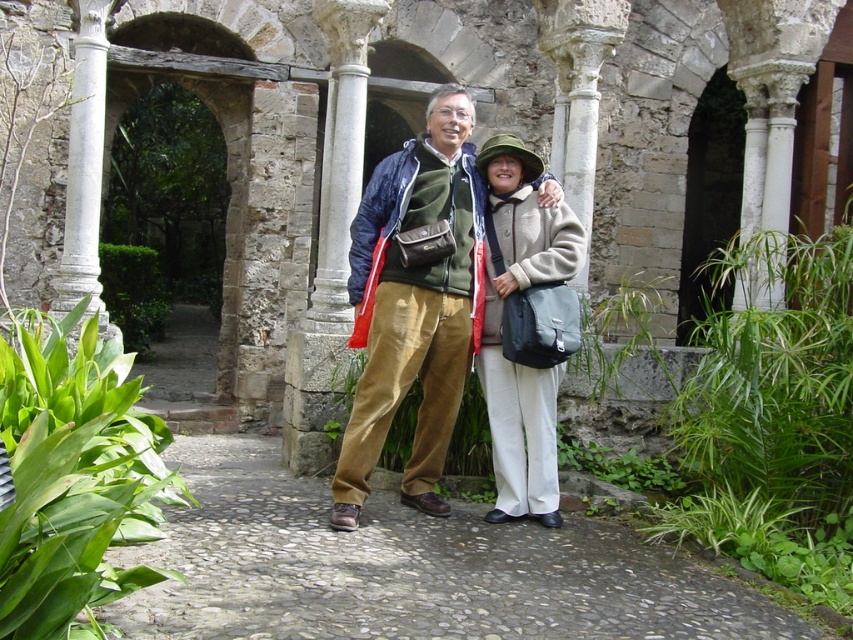
Describe the element at coordinates (410, 570) in the screenshot. The image size is (853, 640). I see `gray cobblestone path at center` at that location.

Is point (451, 621) closer to camera compared to point (456, 285)?

Yes.

The width and height of the screenshot is (853, 640). Identify the location of gray cobblestone path at center. (410, 570).

From the picture: Which of these two, matte green jacket at center or light beige wool coat at center, stands taller?

Standing taller between the two is matte green jacket at center.

Who is higher up, matte green jacket at center or light beige wool coat at center?

matte green jacket at center

Between point (372, 312) and point (541, 508), which one is positioned behind?

The point (372, 312) is more distant.

The height and width of the screenshot is (640, 853). I want to click on matte green jacket at center, so click(x=415, y=301).

This screenshot has width=853, height=640. I want to click on matte green jacket at center, so click(x=415, y=301).

Who is more forward, (392, 163) or (73, 289)?

Point (392, 163) is in front.

Which is in front, point (450, 93) or point (84, 212)?

Point (450, 93) is more forward.

Locate an element on the screen. Image resolution: width=853 pixels, height=640 pixels. matte green jacket at center is located at coordinates (415, 301).